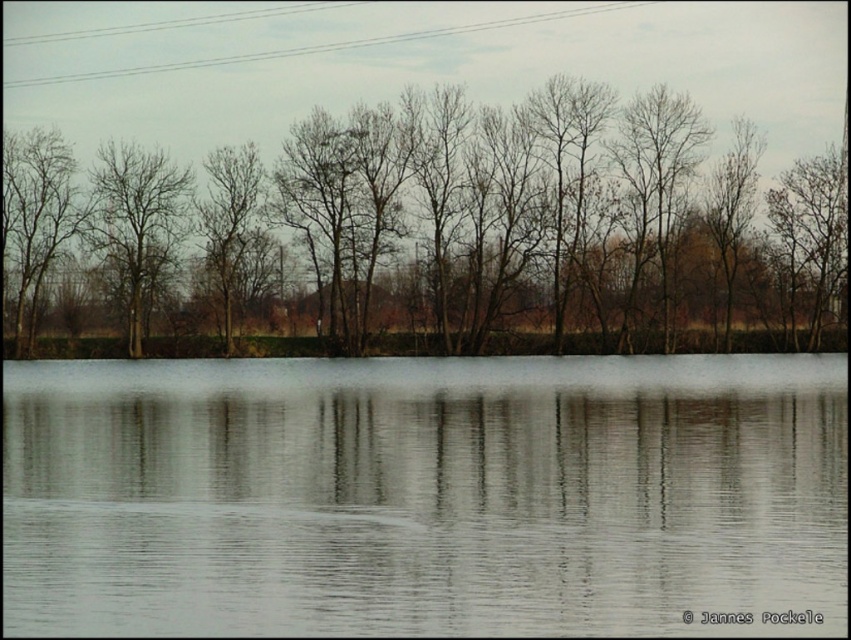
Question: Can you confirm if bare branches at center is positioned above bare branches at left?

Choices:
 (A) no
 (B) yes

Answer: (A)

Question: Does transparent water at center lie in front of bare branches at left?

Choices:
 (A) no
 (B) yes

Answer: (B)

Question: Among these objects, which one is nearest to the camera?

Choices:
 (A) bare branches at center
 (B) transparent water at center
 (C) bare branches at left

Answer: (B)

Question: Which point is closer to the camera?

Choices:
 (A) bare branches at center
 (B) transparent water at center

Answer: (B)

Question: Can you confirm if bare branches at center is positioned below bare branches at left?

Choices:
 (A) yes
 (B) no

Answer: (A)

Question: Which point is farther to the camera?

Choices:
 (A) coord(437,112)
 (B) coord(421,417)
 (C) coord(127,289)

Answer: (C)